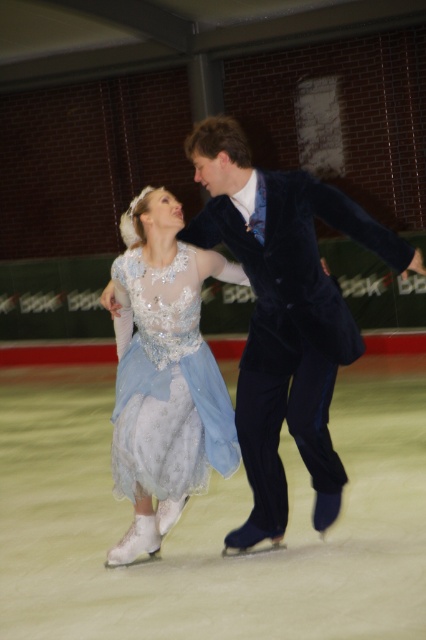
Question: Observing the image, what is the correct spatial positioning of shiny white skates at center in reference to satin blue dress at center?

Choices:
 (A) right
 (B) left

Answer: (B)

Question: Does shiny white skates at center come in front of satin blue dress at center?

Choices:
 (A) yes
 (B) no

Answer: (A)

Question: Is shiny white skates at center bigger than satin blue dress at center?

Choices:
 (A) no
 (B) yes

Answer: (A)

Question: Which of the following is the farthest from the observer?

Choices:
 (A) shiny white skates at center
 (B) satin blue dress at center

Answer: (B)

Question: Estimate the real-world distances between objects in this image. Which object is farther from the light blue satin dress at center?

Choices:
 (A) satin blue dress at center
 (B) shiny white skates at center

Answer: (B)

Question: Among these objects, which one is nearest to the camera?

Choices:
 (A) satin blue dress at center
 (B) light blue satin dress at center
 (C) shiny white skates at center

Answer: (B)